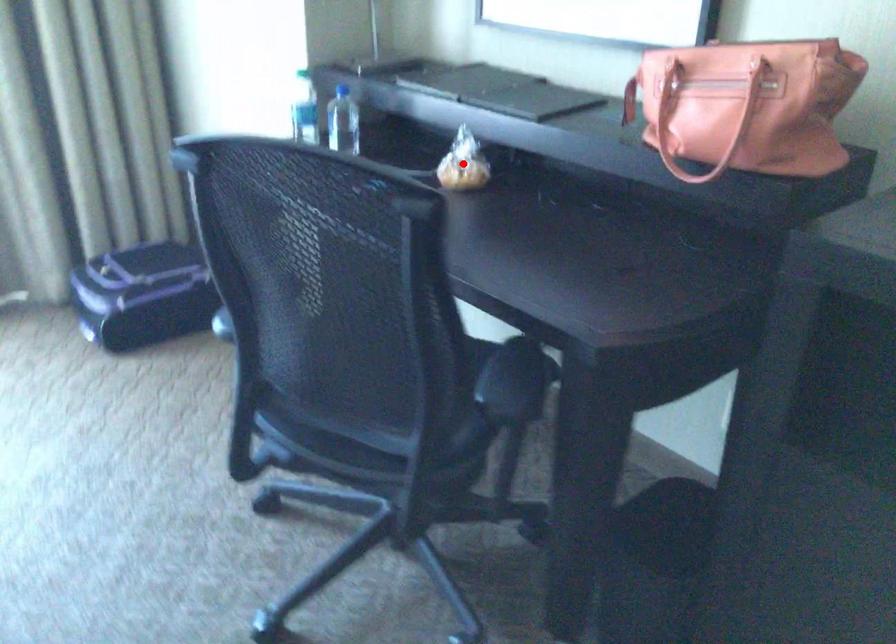
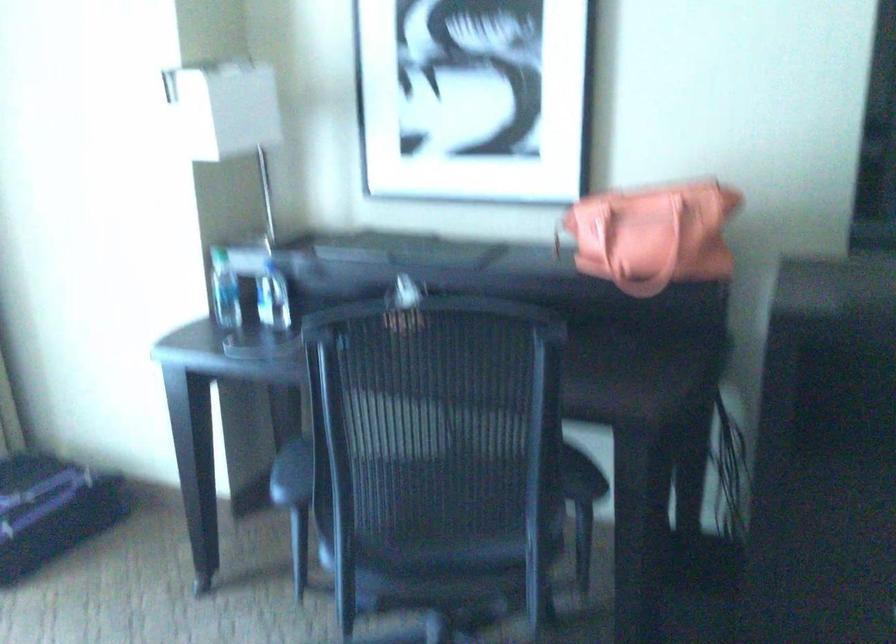
Question: I am providing you with two images of the same scene from different viewpoints. A red point is marked on the first image. At the location where the point appears in image 1, is it still visible in image 2?

Choices:
 (A) Yes
 (B) No

Answer: (B)